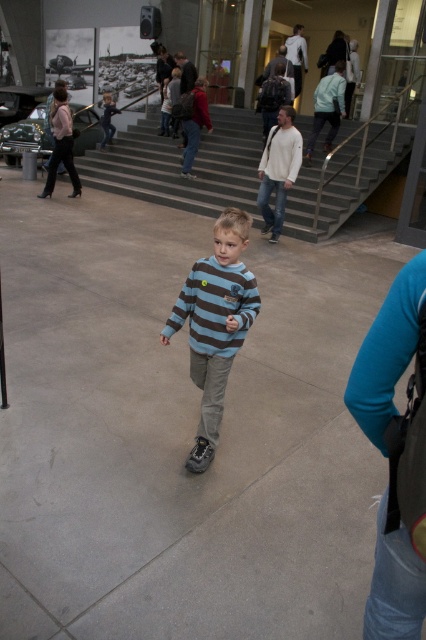
You are an art curator standing at the entrance of the museum. You need to place a matte red sweater at center in such a way that it is visible from both the staircase and the large black and white photograph on the left wall. Is the current placement at point (195, 125) suitable for this requirement?

The matte red sweater at center is placed at point (195, 125), which is centrally located in the museum space. This position allows visibility from both the staircase and the large black and white photograph on the left wall, making it suitable for the requirement.

You are standing in the museum and want to walk to the gray concrete pavement at center. Which direction should you move relative to your current position?

The gray concrete pavement at center is located at point 0.677 on the x axis and 0.420 on the y axis, so you should move towards the center of the image to reach it.

You are an art curator planning to hang a new painting in the museum. The painting is 1.5 meters wide and needs to be placed at the same position as the matte red sweater at center. Is there enough space for the painting at that location?

The matte red sweater at center is located at point coordinates (x=195, y=125). Since the painting is 1.5 meters wide, we need to check the available space at that position. However, the provided information does not specify the dimensions of the area at that coordinate. Therefore, it is impossible to determine if the space is sufficient without additional measurements.